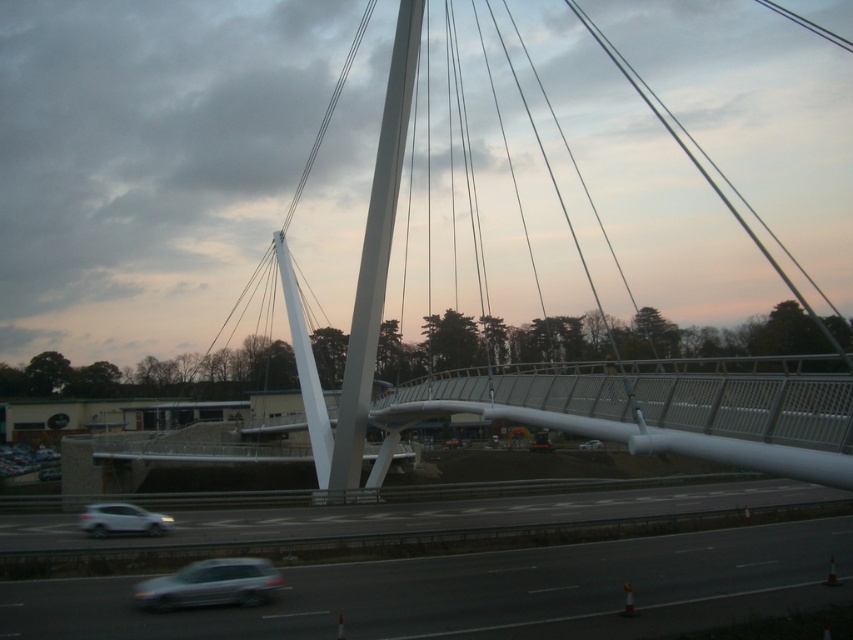
You are a delivery truck driver who needs to pass through the smooth asphalt highway at lower center. Considering the width of your truck, which is wider than the white glossy car at lower left, can you safely navigate through the highway without any issues?

The smooth asphalt highway at lower center is wider than the white glossy car at lower left, so the truck can safely navigate through the highway since its width is sufficient to accommodate the truck.

You are a driver in a satin silver car at lower center on a smooth asphalt highway at lower center. You want to change lanes to the right. Is there enough space to do so?

The smooth asphalt highway at lower center might be wider than satin silver car at lower center, so there could be enough space to change lanes to the right, but it depends on the exact width difference and current traffic conditions.